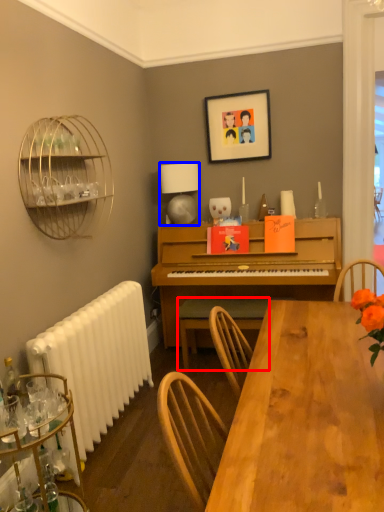
Question: Which point is further to the camera, chair (highlighted by a red box) or lamp (highlighted by a blue box)?

Choices:
 (A) chair
 (B) lamp

Answer: (B)